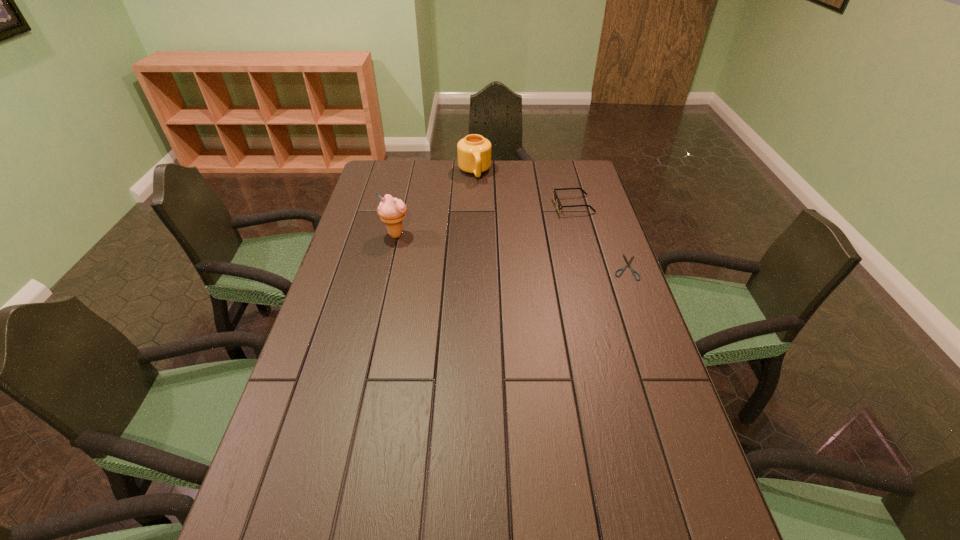
This screenshot has width=960, height=540. I want to click on vacant space on the desktop that is between the icecream and the shortest object and is positioned on the lenses of the second farthest object, so click(474, 246).

Locate an element on the screen. This screenshot has height=540, width=960. vacant spot on the desktop that is between the leftmost object and the shears and is positioned on the handle side of the mug is located at coordinates (494, 248).